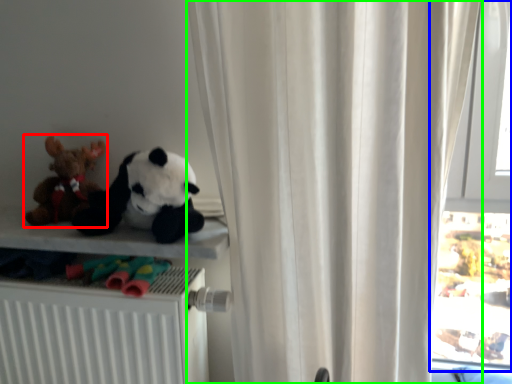
Question: Which object is the closest to the toy (highlighted by a red box)? Choose among these: window (highlighted by a blue box) or curtain (highlighted by a green box).

Choices:
 (A) window
 (B) curtain

Answer: (B)